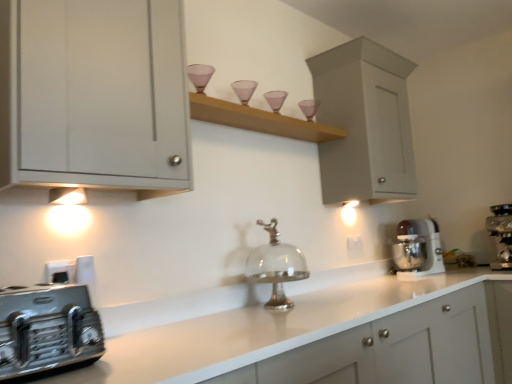
Question: Is metallic stainless steel coffee maker at right, which is the 3th home appliance from left to right, wider or thinner than white plastic electric outlet at center?

Choices:
 (A) thin
 (B) wide

Answer: (B)

Question: Relative to white plastic electric outlet at center, is metallic stainless steel coffee maker at right, the 1th home appliance from the right, in front or behind?

Choices:
 (A) front
 (B) behind

Answer: (A)

Question: Considering the real-world distances, which object is closest to the matte gray cabinet at upper left, which appears as the second cabinetry when viewed from the back?

Choices:
 (A) white plastic stand mixer at right, the 3th home appliance from the front
 (B) metallic stainless steel coffee maker at right, which is the 3th home appliance from left to right
 (C) white matte cabinet at upper right, the first cabinetry viewed from the back
 (D) white plastic electric outlet at center
 (E) silver metallic bell at center

Answer: (E)

Question: Estimate the real-world distances between objects in this image. Which object is farther from the white plastic stand mixer at right, the first home appliance from the back?

Choices:
 (A) white matte cabinet at upper right, the second cabinetry when ordered from left to right
 (B) matte gray cabinet at upper left, the first cabinetry from the left
 (C) metallic silver toaster at lower left, which is the third home appliance from back to front
 (D) white plastic electric outlet at center
 (E) metallic stainless steel coffee maker at right, positioned as the second home appliance in front-to-back order

Answer: (C)